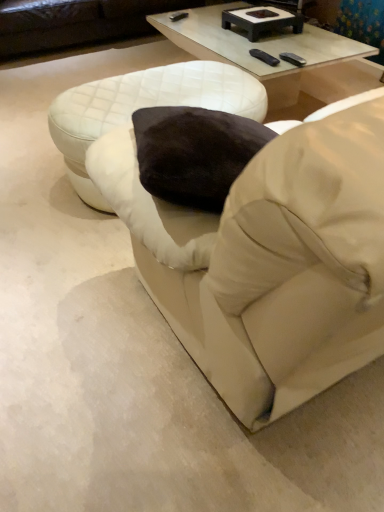
Question: From the image's perspective, relative to black rubber remote at upper right, is beige fabric bean bag chair at center above or below?

Choices:
 (A) below
 (B) above

Answer: (A)

Question: Based on their positions, is beige fabric bean bag chair at center located to the left or right of black rubber remote at upper right?

Choices:
 (A) left
 (B) right

Answer: (B)

Question: Which object is positioned farthest from the black matte rectangular tray at upper center?

Choices:
 (A) matte white studio couch at upper center
 (B) beige fabric bean bag chair at center
 (C) black rubber remote at upper right
 (D) clear glass coffee table at upper center
 (E) white quilted ottoman at center

Answer: (B)

Question: Which of these objects is positioned closest to the black rubber remote at upper right?

Choices:
 (A) black matte rectangular tray at upper center
 (B) matte white studio couch at upper center
 (C) clear glass coffee table at upper center
 (D) beige fabric bean bag chair at center
 (E) white quilted ottoman at center

Answer: (A)